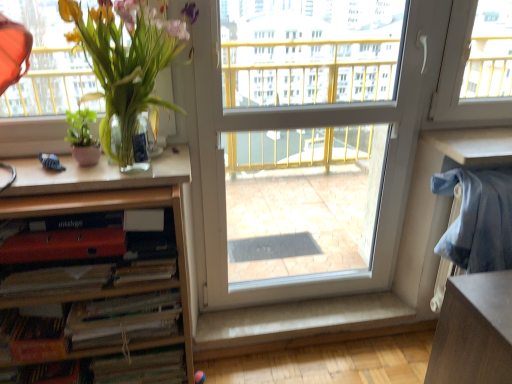
Find the location of a particular element. The height and width of the screenshot is (384, 512). free space that is to the left of green matte plant at left, marked as the first houseplant in a left-to-right arrangement is located at coordinates (35, 160).